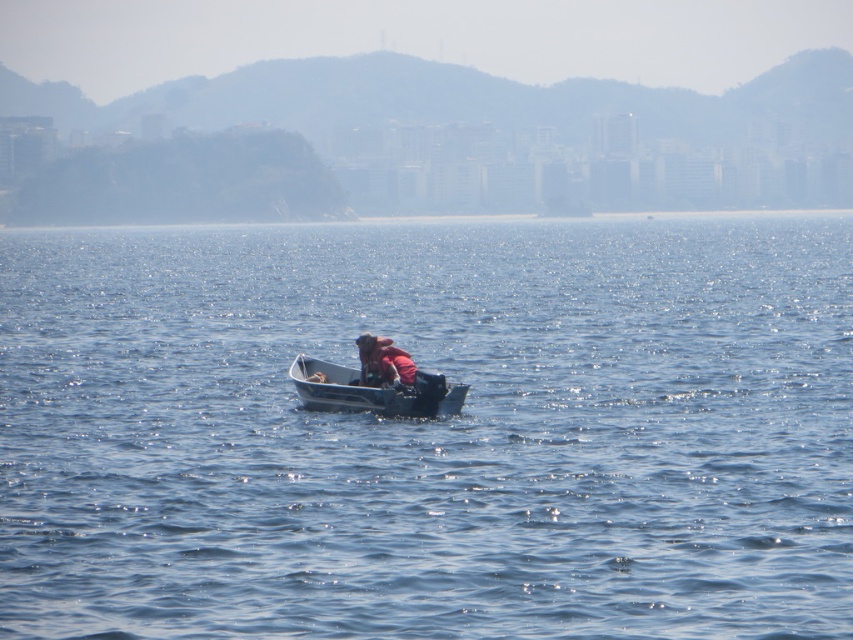
Consider the image. Can you confirm if blue water at center is shorter than metallic gray canoe at center?

No.

Is blue water at center taller than metallic gray canoe at center?

Correct, blue water at center is much taller as metallic gray canoe at center.

Where is `blue water at center`? The height and width of the screenshot is (640, 853). blue water at center is located at coordinates (430, 429).

Between metallic gray canoe at center and pink fabric at center, which one is positioned lower?

Positioned lower is metallic gray canoe at center.

Is metallic gray canoe at center closer to the viewer compared to pink fabric at center?

Yes, it is.

From the picture: Who is more distant from viewer, (405, 396) or (415, 368)?

The point (415, 368) is behind.

Identify the location of metallic gray canoe at center. The width and height of the screenshot is (853, 640). (373, 392).

Can you confirm if blue water at center is shorter than pink fabric at center?

No.

Between point (340, 468) and point (386, 369), which one is positioned behind?

The point (386, 369) is more distant.

Find the location of a particular element. The image size is (853, 640). blue water at center is located at coordinates (430, 429).